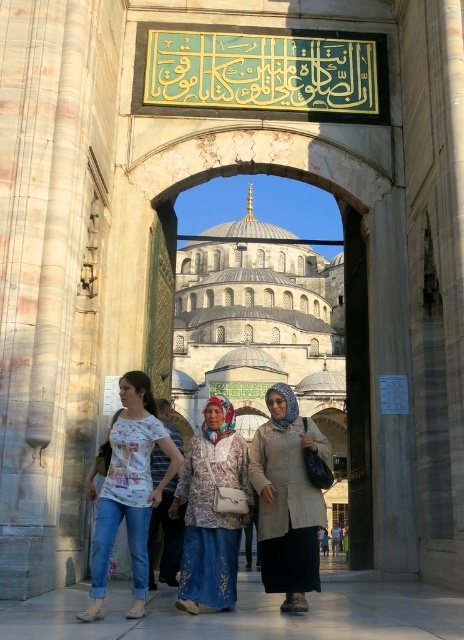
You are standing at the entrance of the Blue Mosque and want to take a photo of the archway. You notice a specific point marked at coordinates (281, 337). Which object does this point correspond to?

The point at coordinates (281, 337) corresponds to the blue stone archway at center.

You are a photographer standing outside the entrance of the Blue Mosque. You want to take a photo of the beige woolen cardigan at center and denim skirt at center. Which object should you zoom in on to capture more details of the clothing items?

The beige woolen cardigan at center is larger in size than the denim skirt at center, so you should zoom in on the beige woolen cardigan at center to capture more details of the clothing items.